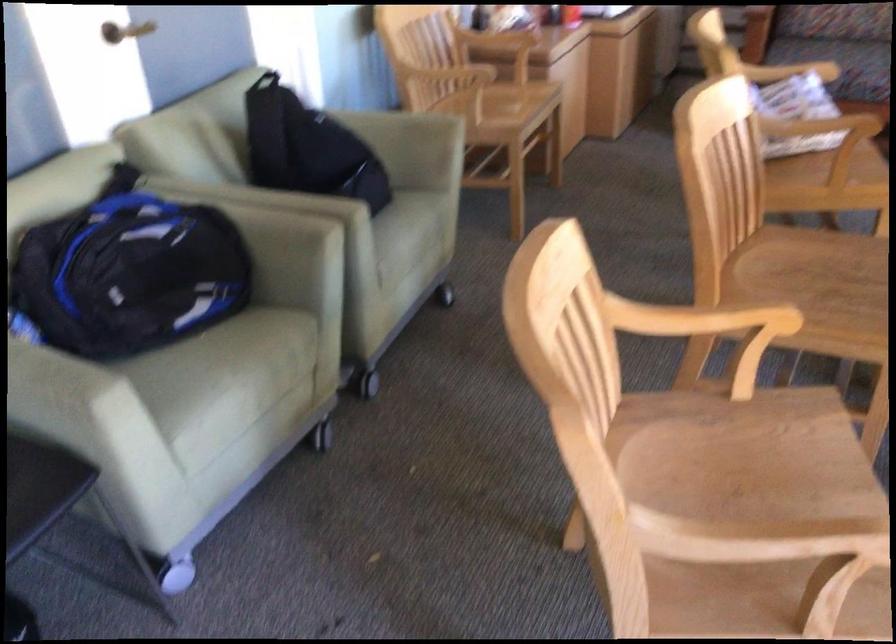
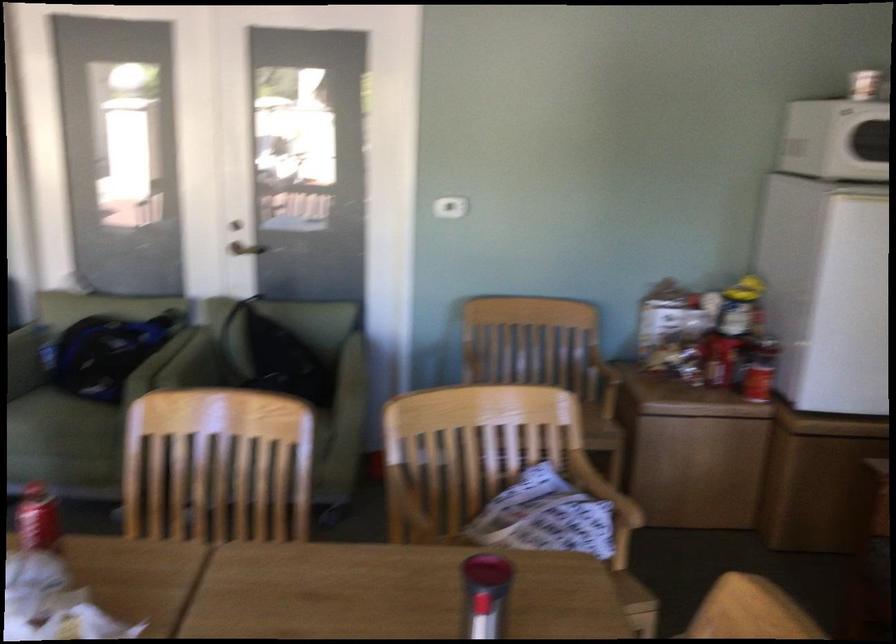
Question: I am providing you with two images of the same scene from different viewpoints. After the viewpoint changes to image2, which objects are now occluded?

Choices:
 (A) sofa sitting surface
 (B) wooden chair sitting surface
 (C) packing tape roll
 (D) sofa armrest

Answer: (D)